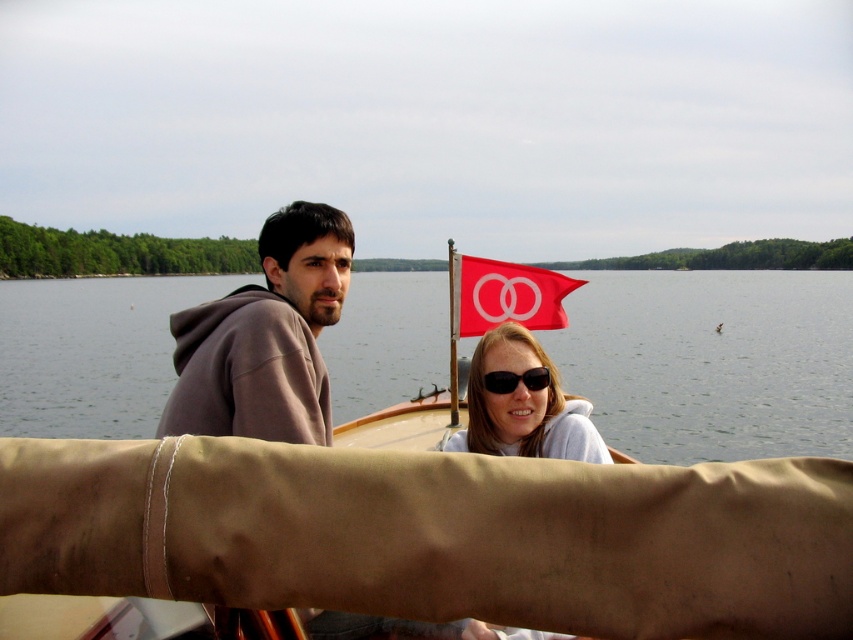
Which is below, clear water at center or brown hoodie at center?

brown hoodie at center is lower down.

Is point (676, 381) positioned behind point (219, 435)?

Yes, point (676, 381) is behind point (219, 435).

Does point (142, 435) come closer to viewer compared to point (289, 291)?

No.

Identify the location of clear water at center. (712, 362).

Can you confirm if brown hoodie at center is thinner than red fabric flag at upper center?

Yes.

Between point (281, 236) and point (517, 298), which one is positioned behind?

The point (517, 298) is more distant.

This screenshot has height=640, width=853. What are the coordinates of `brown hoodie at center` in the screenshot? It's located at (265, 337).

Does brown hoodie at center have a greater height compared to matte white sunglasses at center?

Yes.

Is brown hoodie at center thinner than matte white sunglasses at center?

Yes.

Is point (207, 305) less distant than point (537, 442)?

Yes, it is in front of point (537, 442).

At what (x,y) coordinates should I click in order to perform the action: click on brown hoodie at center. Please return your answer as a coordinate pair (x, y). The image size is (853, 640). Looking at the image, I should click on (265, 337).